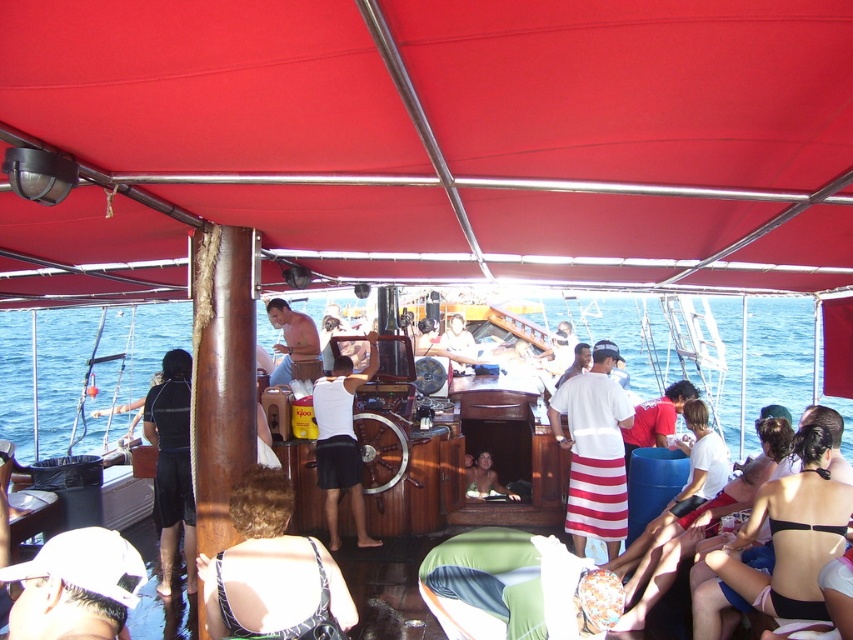
Question: Is white striped fabric at center closer to the viewer compared to smooth tan skin at center?

Choices:
 (A) yes
 (B) no

Answer: (A)

Question: Which object is positioned farthest from the black bikini top at lower right?

Choices:
 (A) blue water at center
 (B) red fabric canopy at upper center
 (C) black matte dress at lower left

Answer: (A)

Question: Which point is farther to the camera?

Choices:
 (A) (730, 372)
 (B) (590, 436)

Answer: (A)

Question: Does black matte dress at lower left have a greater width compared to smooth skin face at center?

Choices:
 (A) no
 (B) yes

Answer: (B)

Question: Does blue water at center lie behind white striped fabric at center?

Choices:
 (A) yes
 (B) no

Answer: (A)

Question: Which point is farther to the camera?

Choices:
 (A) white matte tank top at center
 (B) blue water at center

Answer: (B)